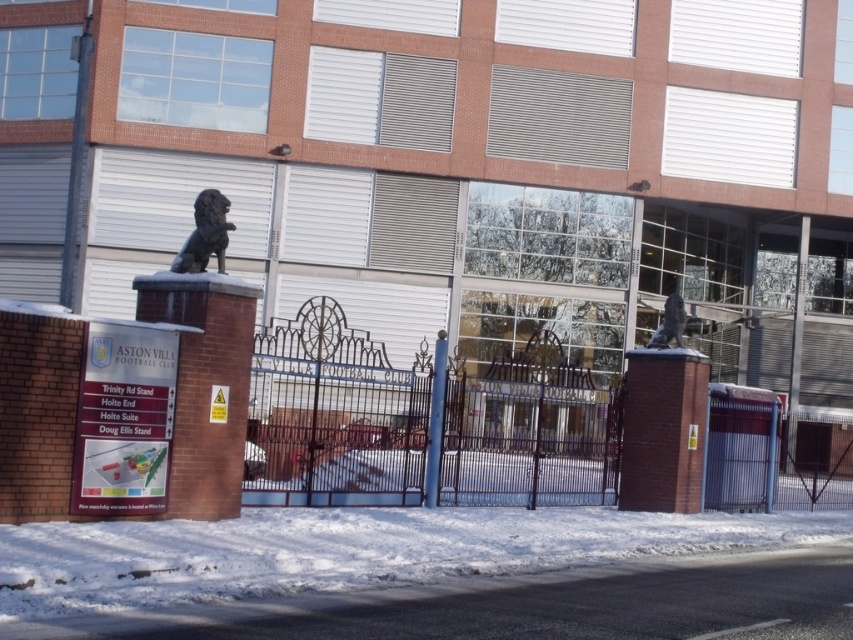
Does white powdery snow at lower left appear on the right side of black polished stone lion at upper center?

Indeed, white powdery snow at lower left is positioned on the right side of black polished stone lion at upper center.

Who is more forward, (619, 556) or (219, 262)?

Positioned in front is point (619, 556).

Is point (262, 582) more distant than point (183, 268)?

No.

You are a GUI agent. You are given a task and a screenshot of the screen. Output one action in this format:
    pyautogui.click(x=<x>, y=<y>)
    Task: Click on the white powdery snow at lower left
    
    Given the screenshot: What is the action you would take?
    pyautogui.click(x=347, y=548)

Who is more forward, (276,339) or (436,460)?

Positioned in front is point (276,339).

Is point (456, 400) positioned behind point (444, 356)?

That is True.

Which is in front, point (415, 490) or point (430, 406)?

Positioned in front is point (415, 490).

The width and height of the screenshot is (853, 640). I want to click on black wrought iron fence at center, so click(337, 417).

Is point (691, 525) behind point (668, 301)?

No, (691, 525) is closer to viewer.

Can you confirm if white powdery snow at lower left is wider than slate gray stone statue at center?

Correct, the width of white powdery snow at lower left exceeds that of slate gray stone statue at center.

Between point (28, 525) and point (679, 321), which one is positioned in front?

Point (28, 525) is more forward.

I want to click on white powdery snow at lower left, so click(x=347, y=548).